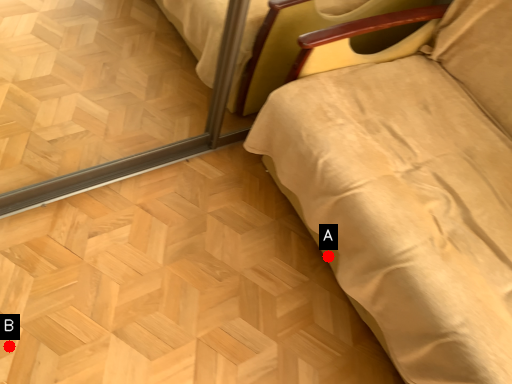
Question: Two points are circled on the image, labeled by A and B beside each circle. Which point is closer to the camera?

Choices:
 (A) A is closer
 (B) B is closer

Answer: (B)